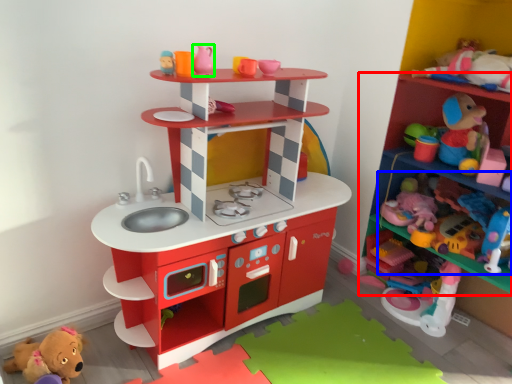
Question: Based on their relative distances, which object is farther from shelf (highlighted by a red box)? Choose from toy (highlighted by a blue box) and toy (highlighted by a green box).

Choices:
 (A) toy
 (B) toy

Answer: (B)